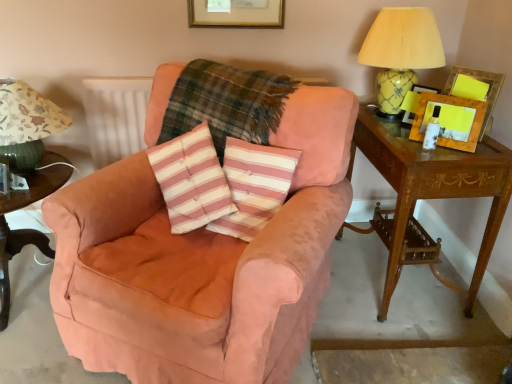
Question: Can you confirm if plaid fabric at center is thinner than wooden picture frame at upper right, marked as the 2th picture frame in a left-to-right arrangement?

Choices:
 (A) yes
 (B) no

Answer: (B)

Question: Are plaid fabric at center and wooden picture frame at upper right, the 1th picture frame positioned from the right, located far from each other?

Choices:
 (A) yes
 (B) no

Answer: (B)

Question: Is plaid fabric at center taller than wooden picture frame at upper right, marked as the 2th picture frame in a left-to-right arrangement?

Choices:
 (A) yes
 (B) no

Answer: (A)

Question: Considering the relative positions of plaid fabric at center and wooden picture frame at upper right, the 1th picture frame positioned from the right, in the image provided, is plaid fabric at center behind wooden picture frame at upper right, the 1th picture frame positioned from the right,?

Choices:
 (A) no
 (B) yes

Answer: (A)

Question: Does plaid fabric at center come in front of wooden picture frame at upper right, the 1th picture frame positioned from the right?

Choices:
 (A) no
 (B) yes

Answer: (B)

Question: From a real-world perspective, is plaid fabric at center positioned above or below wooden picture frame at right, which is counted as the second picture frame, starting from the right?

Choices:
 (A) below
 (B) above

Answer: (A)

Question: Is plaid fabric at center taller or shorter than wooden picture frame at right, which is counted as the second picture frame, starting from the right?

Choices:
 (A) tall
 (B) short

Answer: (A)

Question: From the image's perspective, relative to wooden picture frame at right, which is the first picture frame from left to right, is plaid fabric at center above or below?

Choices:
 (A) above
 (B) below

Answer: (B)

Question: Looking at the image, does plaid fabric at center seem bigger or smaller compared to wooden picture frame at right, which is counted as the second picture frame, starting from the right?

Choices:
 (A) small
 (B) big

Answer: (B)

Question: Considering the positions of pink striped cushion at center and wooden picture frame at upper right, marked as the 2th picture frame in a left-to-right arrangement, in the image, is pink striped cushion at center taller or shorter than wooden picture frame at upper right, marked as the 2th picture frame in a left-to-right arrangement,?

Choices:
 (A) short
 (B) tall

Answer: (B)

Question: In terms of size, does pink striped cushion at center appear bigger or smaller than wooden picture frame at upper right, the 1th picture frame positioned from the right?

Choices:
 (A) small
 (B) big

Answer: (B)

Question: From a real-world perspective, is pink striped cushion at center above or below wooden picture frame at upper right, the 1th picture frame positioned from the right?

Choices:
 (A) above
 (B) below

Answer: (B)

Question: In the image, is pink striped cushion at center positioned in front of or behind wooden picture frame at upper right, marked as the 2th picture frame in a left-to-right arrangement?

Choices:
 (A) behind
 (B) front

Answer: (B)

Question: Is pink striped cushion at center wider or thinner than plaid fabric at center?

Choices:
 (A) wide
 (B) thin

Answer: (B)

Question: Visually, is pink striped cushion at center positioned to the left or to the right of plaid fabric at center?

Choices:
 (A) right
 (B) left

Answer: (A)